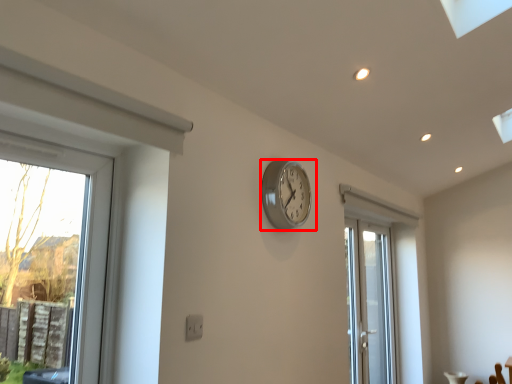
Question: In this image, where is wall clock (annotated by the red box) located relative to door?

Choices:
 (A) left
 (B) right

Answer: (A)